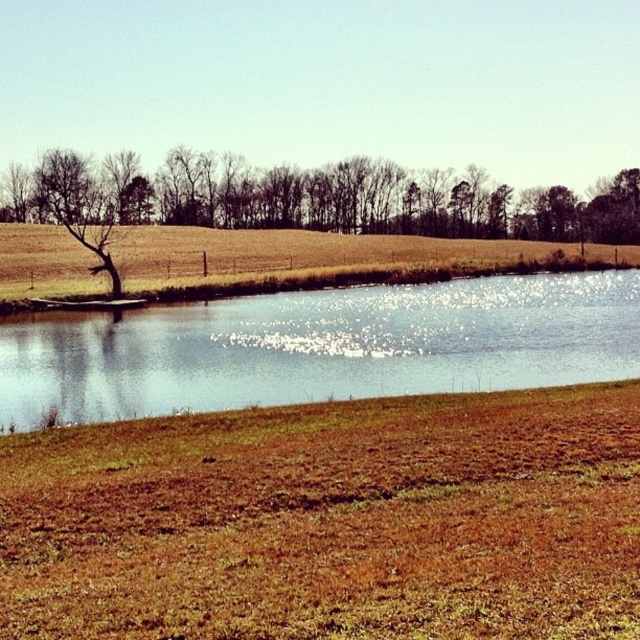
Question: Does brown soil at lower center have a lesser width compared to blue glassy lake at center?

Choices:
 (A) yes
 (B) no

Answer: (A)

Question: Which of the following is the closest to the observer?

Choices:
 (A) brown soil at lower center
 (B) bare branches at upper center
 (C) brown grassy field at center
 (D) blue glassy lake at center

Answer: (A)

Question: Can you confirm if brown soil at lower center is bigger than brown grassy field at center?

Choices:
 (A) no
 (B) yes

Answer: (A)

Question: Which point is closer to the camera taking this photo?

Choices:
 (A) (209, 243)
 (B) (346, 214)

Answer: (A)

Question: Which point is farther to the camera?

Choices:
 (A) bare branches at upper center
 (B) brown grassy field at center

Answer: (A)

Question: Is blue glassy lake at center above brown grassy field at center?

Choices:
 (A) yes
 (B) no

Answer: (B)